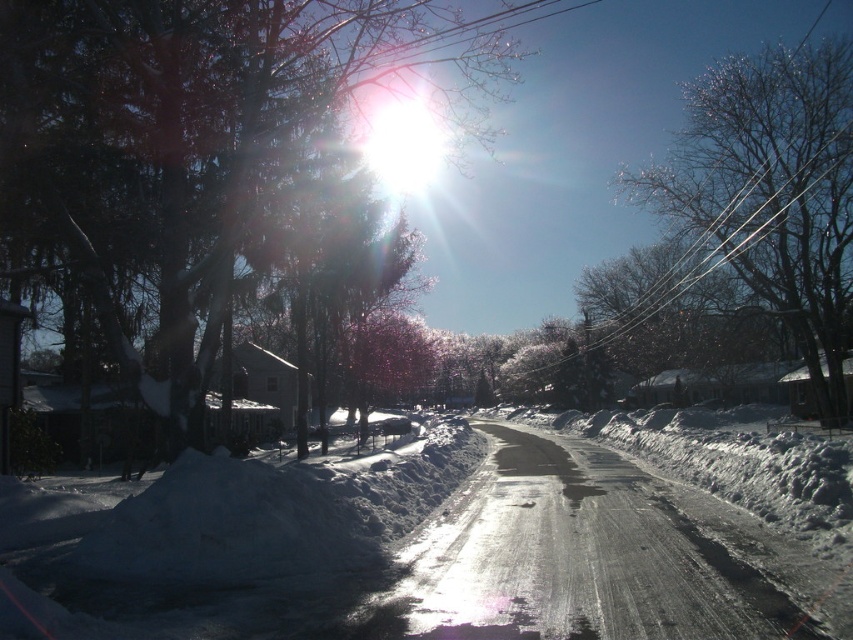
You are standing at the point with coordinates point (741, 145) and want to walk towards the point with coordinates point (698, 621). Based on the scene description, will you walk towards the direction of the road or away from it?

Since point (698, 621) is in front of point (741, 145), you are walking towards the direction of the road as the road is in the foreground of the image.

In the scene shown: You are standing on the road in the winter scene and want to know which object is taller between the white powdery snow at center and the bare branches at upper right. Can you determine this based on the scene?

The white powdery snow at center has a lesser height compared to the bare branches at upper right, so the bare branches at upper right are taller.